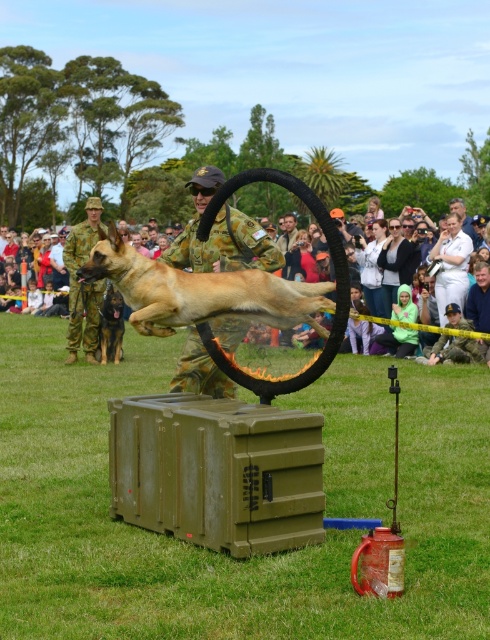
Question: Which of the following is the closest to the observer?

Choices:
 (A) brown fur dog at center
 (B) golden fur dog at center
 (C) camouflage uniform at center

Answer: (B)

Question: From the image, what is the correct spatial relationship of golden fur dog at center in relation to camouflage uniform at center?

Choices:
 (A) left
 (B) right

Answer: (A)

Question: Is golden fur dog at center wider than brown fur dog at center?

Choices:
 (A) yes
 (B) no

Answer: (A)

Question: Which object is the farthest from the golden fur dog at center?

Choices:
 (A) camouflage uniform at center
 (B) brown fur dog at center

Answer: (B)

Question: Is golden fur dog at center thinner than brown fur dog at center?

Choices:
 (A) no
 (B) yes

Answer: (A)

Question: Among these points, which one is nearest to the camera?

Choices:
 (A) (192, 285)
 (B) (120, 316)

Answer: (A)